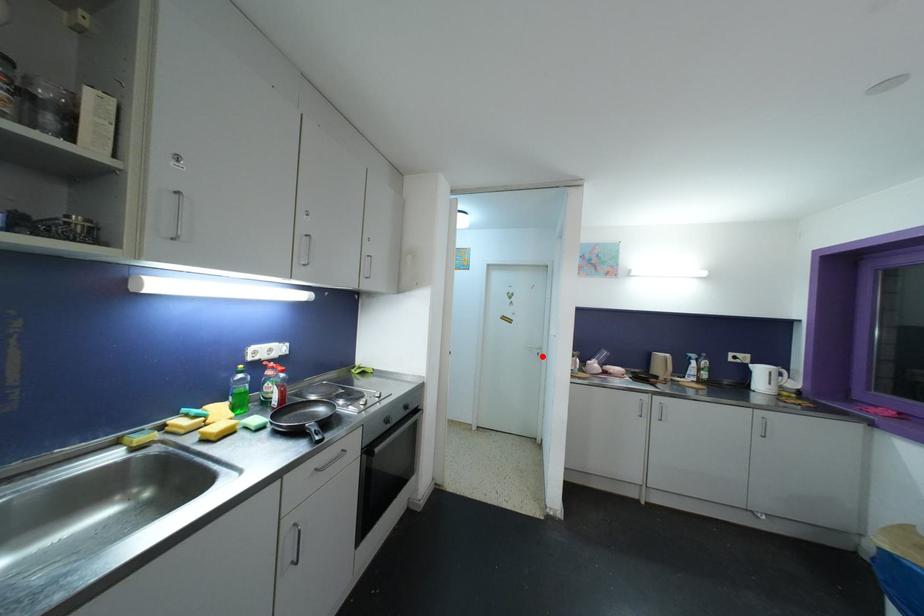
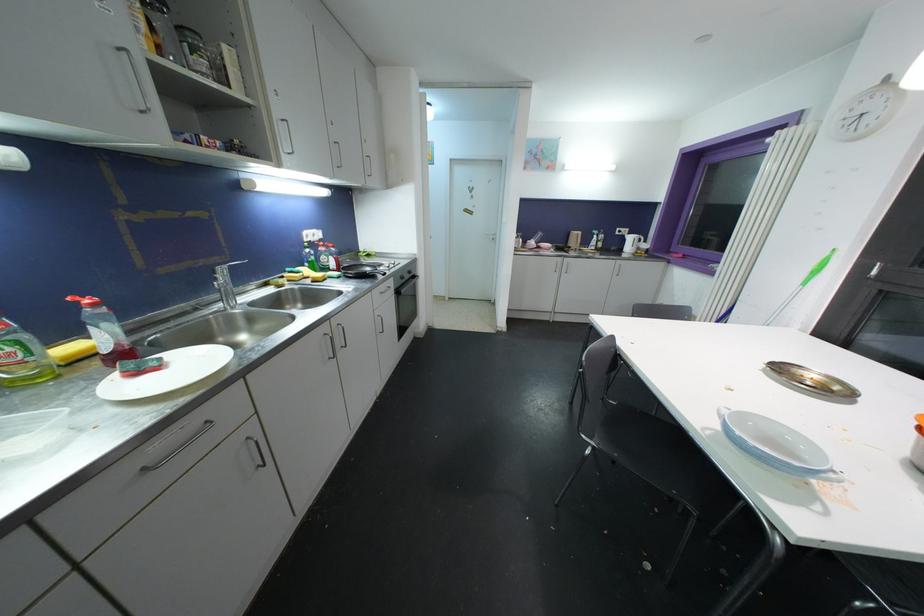
In the second image, find the point that corresponds to the highlighted location in the first image.

(496, 241)